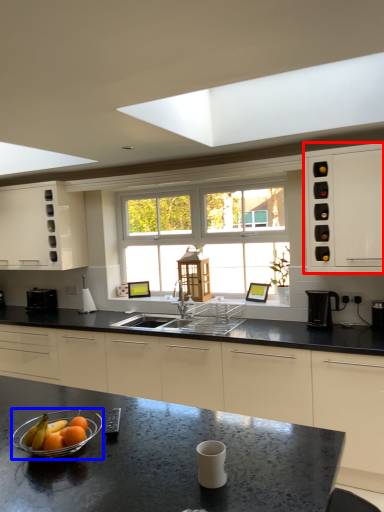
Question: Which object appears farthest to the camera in this image, cabinetry (highlighted by a red box) or glass bowl (highlighted by a blue box)?

Choices:
 (A) cabinetry
 (B) glass bowl

Answer: (A)